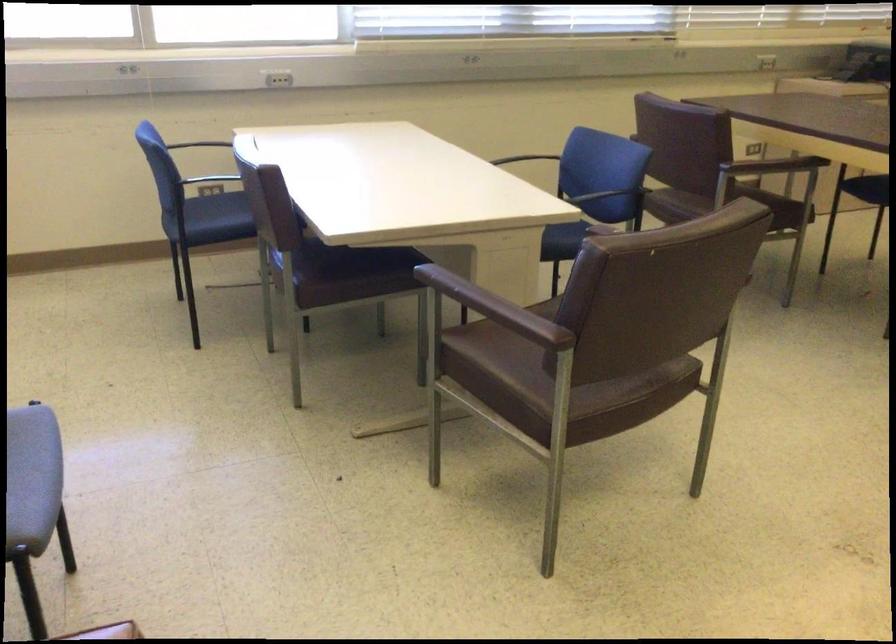
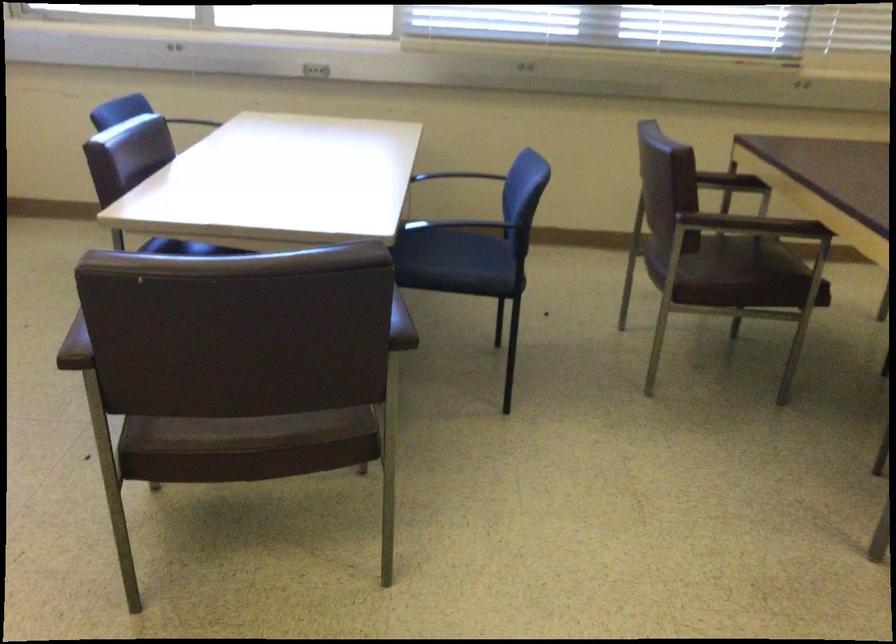
Find the pixel in the second image that matches point 531,327 in the first image.

(75, 346)